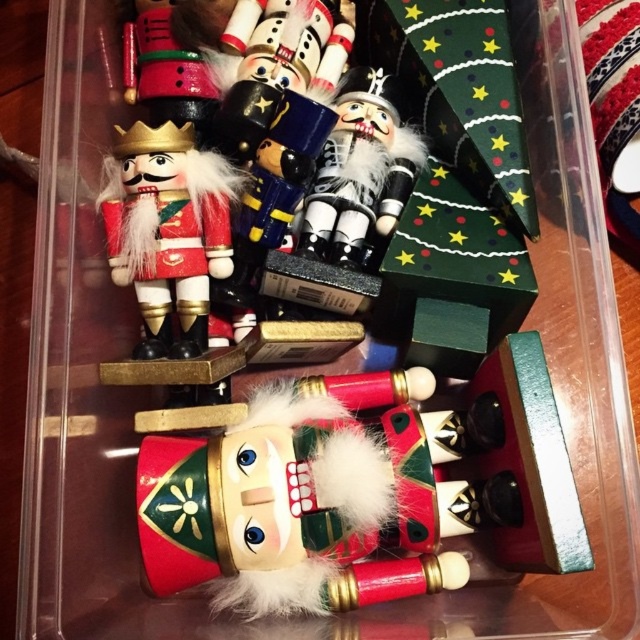
Does matte red wood nutcracker at center appear on the right side of matte black nutcracker at center?

Incorrect, matte red wood nutcracker at center is not on the right side of matte black nutcracker at center.

Does matte red wood nutcracker at center have a lesser width compared to matte black nutcracker at center?

No.

I want to click on matte red wood nutcracker at center, so click(x=358, y=492).

Image resolution: width=640 pixels, height=640 pixels. What are the coordinates of `matte red wood nutcracker at center` in the screenshot? It's located at (358, 492).

Does matte red wood nutcracker at center come in front of wooden nutcracker at left?

Yes, it is.

Does matte red wood nutcracker at center have a greater height compared to wooden nutcracker at left?

Yes, matte red wood nutcracker at center is taller than wooden nutcracker at left.

Is point (236, 442) farther from camera compared to point (204, 266)?

No, (236, 442) is in front of (204, 266).

Where is `matte red wood nutcracker at center`? This screenshot has width=640, height=640. matte red wood nutcracker at center is located at coordinates (358, 492).

Between wooden nutcracker at left and matte black nutcracker at center, which one is positioned lower?

Positioned lower is wooden nutcracker at left.

Is wooden nutcracker at left smaller than matte black nutcracker at center?

No, wooden nutcracker at left is not smaller than matte black nutcracker at center.

Between point (161, 196) and point (337, 161), which one is positioned behind?

Positioned behind is point (337, 161).

Where is `wooden nutcracker at left`? wooden nutcracker at left is located at coordinates (168, 228).